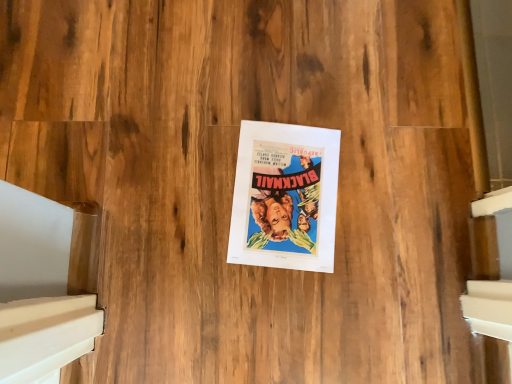
Find the location of a particular element. The height and width of the screenshot is (384, 512). vacant space to the right of matte paper poster at center is located at coordinates (368, 219).